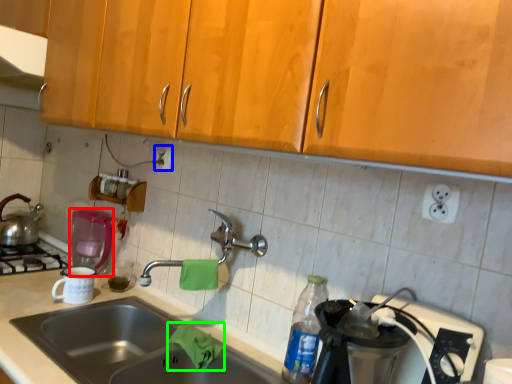
Question: Based on their relative distances, which object is farther from coffee machine (highlighted by a red box)? Choose from electric outlet (highlighted by a blue box) and material (highlighted by a green box).

Choices:
 (A) electric outlet
 (B) material

Answer: (B)